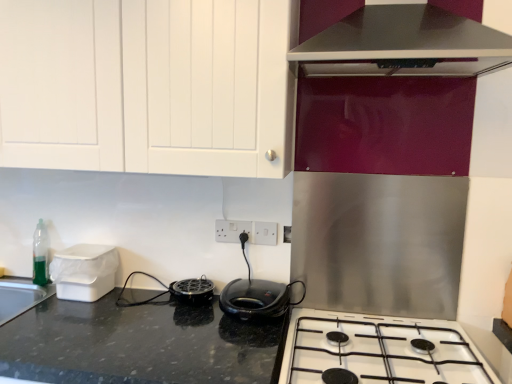
What is the approximate height of white glossy gas stove at lower center?

The height of white glossy gas stove at lower center is 14.66 centimeters.

Describe the element at coordinates (84, 271) in the screenshot. I see `white plastic container at left` at that location.

At what (x,y) coordinates should I click in order to perform the action: click on black glossy range hood at upper right. Please return your answer as a coordinate pair (x, y). Looking at the image, I should click on [x=404, y=44].

Describe the element at coordinates (232, 230) in the screenshot. I see `white plastic electric outlet at center, the 2th electric outlet when ordered from right to left` at that location.

I want to click on black glossy waffle maker at center, marked as the 2th kitchen appliance in a left-to-right arrangement, so click(257, 298).

The image size is (512, 384). I want to click on white plastic electric outlet at center, the second electric outlet in the left-to-right sequence, so click(266, 233).

Describe the element at coordinates (266, 233) in the screenshot. I see `white plastic electric outlet at center, the second electric outlet in the left-to-right sequence` at that location.

The width and height of the screenshot is (512, 384). In order to click on black speckled granite at center in this screenshot , I will do `click(140, 344)`.

Identify the location of white glossy gas stove at lower center. (380, 350).

From a real-world perspective, which object stands above the other?

From a 3D spatial view, black glossy range hood at upper right is above.

Is white plastic container at left positioned with its back to black glossy range hood at upper right?

No.

From the image's perspective, which is above, white plastic container at left or black glossy range hood at upper right?

black glossy range hood at upper right appears higher in the image.

Considering the relative sizes of white plastic container at left and white plastic electric outlet at center, the 2th electric outlet when ordered from right to left, in the image provided, is white plastic container at left shorter than white plastic electric outlet at center, the 2th electric outlet when ordered from right to left,?

No, white plastic container at left is not shorter than white plastic electric outlet at center, the 2th electric outlet when ordered from right to left.

From a real-world perspective, is white plastic container at left beneath white plastic electric outlet at center, the 2th electric outlet when ordered from right to left?

Yes, from a real-world perspective, white plastic container at left is beneath white plastic electric outlet at center, the 2th electric outlet when ordered from right to left.

How far apart are white plastic container at left and white plastic electric outlet at center, the 2th electric outlet when ordered from right to left?

They are 20.11 inches apart.

From the image's perspective, is black matte grill at center, the 2th kitchen appliance from the right, above white matte cabinet at upper left?

No, from the image's perspective, black matte grill at center, the 2th kitchen appliance from the right, is not over white matte cabinet at upper left.

How different are the orientations of black matte grill at center, the 2th kitchen appliance from the right, and white matte cabinet at upper left in degrees?

The facing directions of black matte grill at center, the 2th kitchen appliance from the right, and white matte cabinet at upper left are 0.00177 degrees apart.

From a real-world perspective, is black matte grill at center, which appears as the 1th kitchen appliance when viewed from the left, physically above white matte cabinet at upper left?

No, from a real-world perspective, black matte grill at center, which appears as the 1th kitchen appliance when viewed from the left, is not on top of white matte cabinet at upper left.

From the picture: Measure the distance between black matte grill at center, which appears as the 1th kitchen appliance when viewed from the left, and white matte cabinet at upper left.

30.47 inches.

Is black glossy waffle maker at center, marked as the 1th kitchen appliance in a right-to-left arrangement, smaller than white glossy gas stove at lower center?

Yes, black glossy waffle maker at center, marked as the 1th kitchen appliance in a right-to-left arrangement, is smaller than white glossy gas stove at lower center.

Is black glossy waffle maker at center, marked as the 2th kitchen appliance in a left-to-right arrangement, far away from white glossy gas stove at lower center?

black glossy waffle maker at center, marked as the 2th kitchen appliance in a left-to-right arrangement, is actually quite close to white glossy gas stove at lower center.

Is black glossy waffle maker at center, marked as the 1th kitchen appliance in a right-to-left arrangement, not inside white glossy gas stove at lower center?

That's correct, black glossy waffle maker at center, marked as the 1th kitchen appliance in a right-to-left arrangement, is outside of white glossy gas stove at lower center.

From the picture: From a real-world perspective, does black glossy waffle maker at center, marked as the 1th kitchen appliance in a right-to-left arrangement, sit lower than white glossy gas stove at lower center?

No, from a real-world perspective, black glossy waffle maker at center, marked as the 1th kitchen appliance in a right-to-left arrangement, is not under white glossy gas stove at lower center.

From a real-world perspective, is white plastic electric outlet at center, which ranks as the first electric outlet in right-to-left order, on top of black matte grill at center, the 2th kitchen appliance from the right?

Yes, from a real-world perspective, white plastic electric outlet at center, which ranks as the first electric outlet in right-to-left order, is above black matte grill at center, the 2th kitchen appliance from the right.

Looking at this image, based on their sizes in the image, would you say white plastic electric outlet at center, the second electric outlet in the left-to-right sequence, is bigger or smaller than black matte grill at center, the 2th kitchen appliance from the right?

white plastic electric outlet at center, the second electric outlet in the left-to-right sequence, is smaller than black matte grill at center, the 2th kitchen appliance from the right.

Identify the location of the 1st electric outlet behind the black matte grill at center, which appears as the 1th kitchen appliance when viewed from the left. (266, 233).

Does white plastic electric outlet at center, which ranks as the first electric outlet in right-to-left order, have a lesser height compared to black matte grill at center, the 2th kitchen appliance from the right?

In fact, white plastic electric outlet at center, which ranks as the first electric outlet in right-to-left order, may be taller than black matte grill at center, the 2th kitchen appliance from the right.

Can you confirm if white matte cabinet at upper left is smaller than white plastic container at left?

Incorrect, white matte cabinet at upper left is not smaller in size than white plastic container at left.

Is white matte cabinet at upper left to the left or to the right of white plastic container at left in the image?

white matte cabinet at upper left is to the right of white plastic container at left.

From a real-world perspective, is white matte cabinet at upper left on top of white plastic container at left?

Yes, from a real-world perspective, white matte cabinet at upper left is above white plastic container at left.

Could you tell me if white matte cabinet at upper left is turned towards white plastic container at left?

No, white matte cabinet at upper left does not turn towards white plastic container at left.

In the scene shown: From the image's perspective, is white glossy gas stove at lower center over white matte cabinet at upper left?

Incorrect, from the image's perspective, white glossy gas stove at lower center is lower than white matte cabinet at upper left.

Looking at the image, does white glossy gas stove at lower center seem bigger or smaller compared to white matte cabinet at upper left?

white glossy gas stove at lower center is smaller than white matte cabinet at upper left.

Which object is closer to the camera taking this photo, white glossy gas stove at lower center or white matte cabinet at upper left?

white glossy gas stove at lower center.

Is white glossy gas stove at lower center positioned far away from white matte cabinet at upper left?

No, there isn't a large distance between white glossy gas stove at lower center and white matte cabinet at upper left.

You are a GUI agent. You are given a task and a screenshot of the screen. Output one action in this format:
    pyautogui.click(x=<x>, y=<y>)
    Task: Click on the appliance that is behind the black glossy range hood at upper right
    This screenshot has width=512, height=384.
    Given the screenshot: What is the action you would take?
    pyautogui.click(x=84, y=271)

Find the location of `appliance below the white plastic electric outlet at center, the 2th electric outlet when ordered from right to left (from the image's perspective)`. appliance below the white plastic electric outlet at center, the 2th electric outlet when ordered from right to left (from the image's perspective) is located at coordinates (84, 271).

Looking at the image, which one is located further to white matte cabinet at upper left, black speckled granite at center or white glossy gas stove at lower center?

Among the two, white glossy gas stove at lower center is located further to white matte cabinet at upper left.

Based on their spatial positions, is white plastic electric outlet at center, placed as the first electric outlet when sorted from left to right, or white glossy gas stove at lower center closer to black matte grill at center, which appears as the 1th kitchen appliance when viewed from the left?

Based on the image, white plastic electric outlet at center, placed as the first electric outlet when sorted from left to right, appears to be nearer to black matte grill at center, which appears as the 1th kitchen appliance when viewed from the left.

Based on their spatial positions, is black matte grill at center, the 2th kitchen appliance from the right, or white plastic electric outlet at center, placed as the first electric outlet when sorted from left to right, further from white matte cabinet at upper left?

black matte grill at center, the 2th kitchen appliance from the right.

Estimate the real-world distances between objects in this image. Which object is closer to black glossy range hood at upper right, white plastic electric outlet at center, the second electric outlet in the left-to-right sequence, or white plastic container at left?

white plastic electric outlet at center, the second electric outlet in the left-to-right sequence.

Based on their spatial positions, is white plastic electric outlet at center, the 2th electric outlet when ordered from right to left, or white matte cabinet at upper left closer to black matte grill at center, which appears as the 1th kitchen appliance when viewed from the left?

white plastic electric outlet at center, the 2th electric outlet when ordered from right to left.

Considering their positions, is white matte cabinet at upper left positioned further to black glossy range hood at upper right than white plastic electric outlet at center, the second electric outlet in the left-to-right sequence?

white plastic electric outlet at center, the second electric outlet in the left-to-right sequence, lies further to black glossy range hood at upper right than the other object.

When comparing their distances from black speckled granite at center, does black glossy waffle maker at center, marked as the 2th kitchen appliance in a left-to-right arrangement, or white glossy gas stove at lower center seem closer?

Among the two, black glossy waffle maker at center, marked as the 2th kitchen appliance in a left-to-right arrangement, is located nearer to black speckled granite at center.

Estimate the real-world distances between objects in this image. Which object is closer to white plastic electric outlet at center, the 2th electric outlet when ordered from right to left, black matte grill at center, the 2th kitchen appliance from the right, or white plastic container at left?

Based on the image, black matte grill at center, the 2th kitchen appliance from the right, appears to be nearer to white plastic electric outlet at center, the 2th electric outlet when ordered from right to left.

At what (x,y) coordinates should I click in order to perform the action: click on kitchen appliance between white plastic container at left and white plastic electric outlet at center, placed as the first electric outlet when sorted from left to right. Please return your answer as a coordinate pair (x, y). The width and height of the screenshot is (512, 384). Looking at the image, I should click on (192, 290).

I want to click on electric outlet between white matte cabinet at upper left and white plastic electric outlet at center, which ranks as the first electric outlet in right-to-left order, from top to bottom, so click(232, 230).

You are a GUI agent. You are given a task and a screenshot of the screen. Output one action in this format:
    pyautogui.click(x=<x>, y=<y>)
    Task: Click on the appliance between white matte cabinet at upper left and black matte grill at center, the 2th kitchen appliance from the right, vertically
    This screenshot has width=512, height=384.
    Given the screenshot: What is the action you would take?
    pyautogui.click(x=84, y=271)

The width and height of the screenshot is (512, 384). I want to click on electric outlet located between black speckled granite at center and white plastic electric outlet at center, placed as the first electric outlet when sorted from left to right, in the depth direction, so click(266, 233).